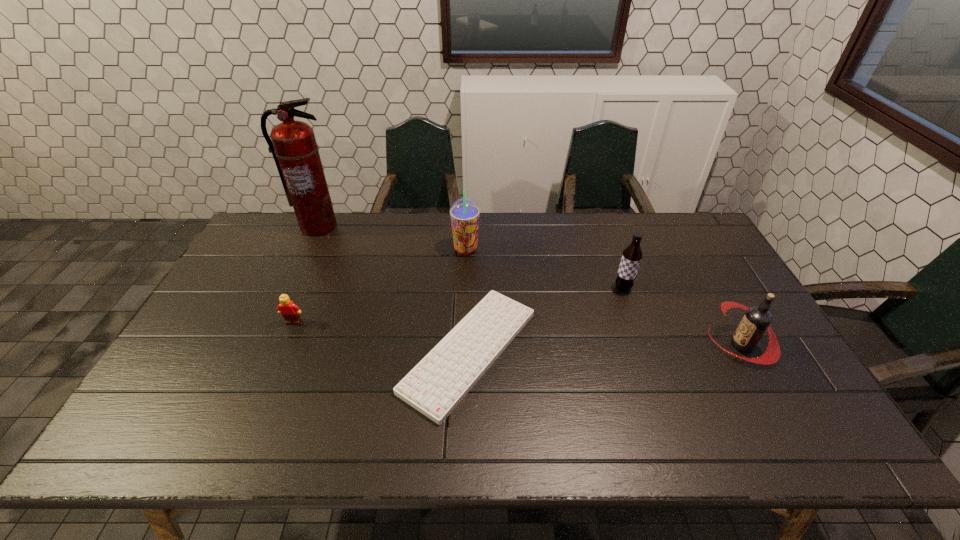
Locate an element on the screen. object present at the left edge is located at coordinates (295, 151).

Locate an element on the screen. This screenshot has height=540, width=960. object situated at the right edge is located at coordinates (757, 319).

Image resolution: width=960 pixels, height=540 pixels. Identify the location of object positioned at the far left corner. (295, 151).

Find the location of a particular element. free space at the far edge of the desktop is located at coordinates (429, 220).

You are a GUI agent. You are given a task and a screenshot of the screen. Output one action in this format:
    pyautogui.click(x=<x>, y=<y>)
    Task: Click on the vacant space at the near edge of the desktop
    The height and width of the screenshot is (540, 960).
    Given the screenshot: What is the action you would take?
    pyautogui.click(x=450, y=449)

Find the location of a particular element. free space at the right edge of the desktop is located at coordinates (723, 275).

Identify the location of vacant area at the far right corner. This screenshot has width=960, height=540. (703, 231).

Where is `free spot between the farther root beer and the fifth nearest object`? This screenshot has height=540, width=960. free spot between the farther root beer and the fifth nearest object is located at coordinates (544, 269).

Locate an element on the screen. This screenshot has height=540, width=960. vacant point located between the computer keyboard and the Lego is located at coordinates (381, 336).

Locate an element on the screen. The height and width of the screenshot is (540, 960). vacant area between the fifth object from left to right and the smoothie is located at coordinates (544, 269).